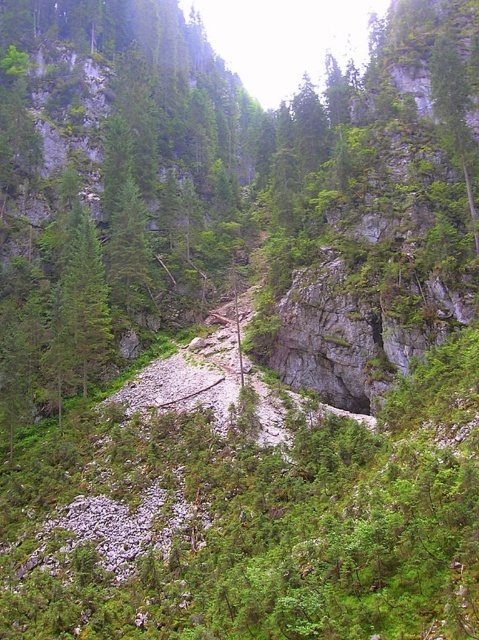
Question: Which point is closer to the camera?

Choices:
 (A) (136, 294)
 (B) (77, 344)

Answer: (B)

Question: Is green matte tree at left to the right of green leafy tree at center from the viewer's perspective?

Choices:
 (A) yes
 (B) no

Answer: (B)

Question: Which point appears closest to the camera in this image?

Choices:
 (A) (101, 330)
 (B) (145, 276)

Answer: (A)

Question: Among these objects, which one is nearest to the camera?

Choices:
 (A) green matte tree at left
 (B) green leafy tree at center

Answer: (A)

Question: Does green matte tree at left have a smaller size compared to green leafy tree at center?

Choices:
 (A) yes
 (B) no

Answer: (B)

Question: Does green matte tree at left have a smaller size compared to green leafy tree at center?

Choices:
 (A) yes
 (B) no

Answer: (B)